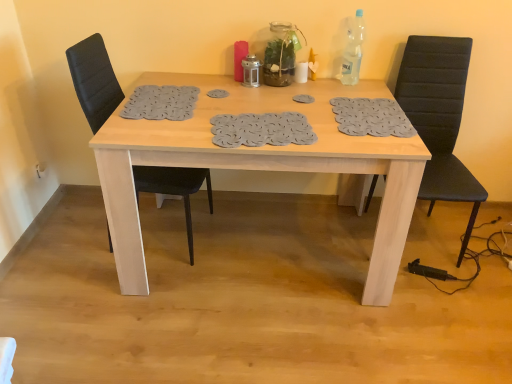
At what (x,y) coordinates should I click in order to perform the action: click on empty space that is in between light wood table at center and black leather chair at right, which is counted as the first chair, starting from the right. Please return your answer as a coordinate pair (x, y). Image resolution: width=512 pixels, height=384 pixels. Looking at the image, I should click on (418, 286).